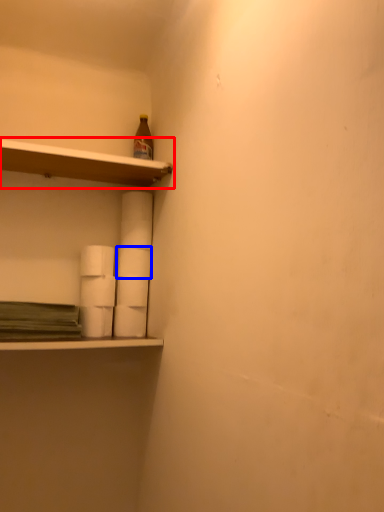
Question: Which object is closer to the camera taking this photo, shelf (highlighted by a red box) or paper towel (highlighted by a blue box)?

Choices:
 (A) shelf
 (B) paper towel

Answer: (A)